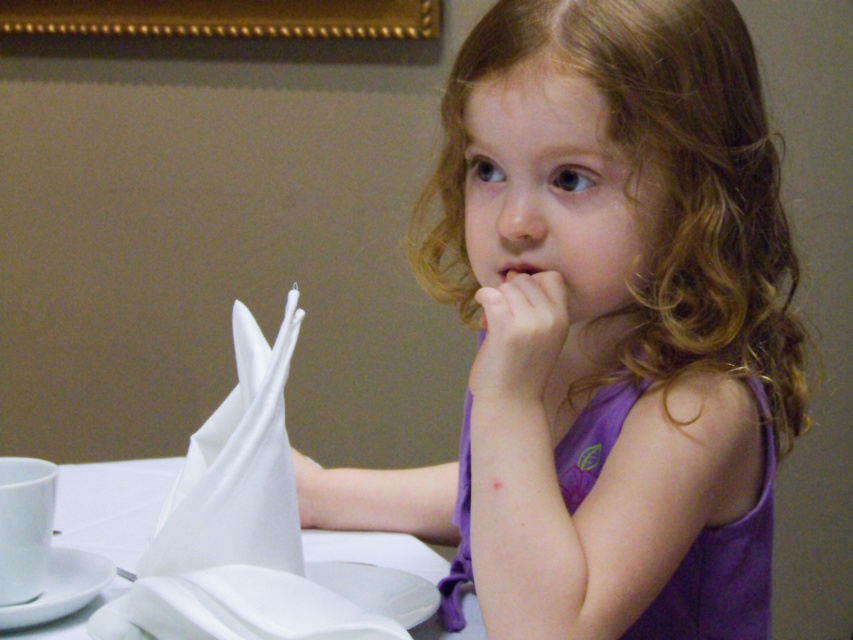
You are the girl in the image. You want to reach for an object in front of you. Which coordinate point should you reach towards, point [567,332] or point [525,269]?

Point [567,332] is in front of point [525,269], so you should reach towards point [567,332].

You are a guest at a formal dinner and want to place your napkin without disturbing the table setting. The smooth skin hand at center is currently holding the napkin. Where should you place it so it doesn t interfere with the white matte saucer at lower left?

Since the smooth skin hand at center is above the white matte saucer at lower left, you should place the napkin on the lap to avoid disturbing the saucer.

You are a guest at a formal dinner and notice the white paper napkin at upper left and the smooth skin hand at center. According to proper etiquette, which item should you place your hand on while waiting for the meal to begin?

According to proper etiquette, you should place your smooth skin hand at center on the white paper napkin at upper left while waiting for the meal to begin.